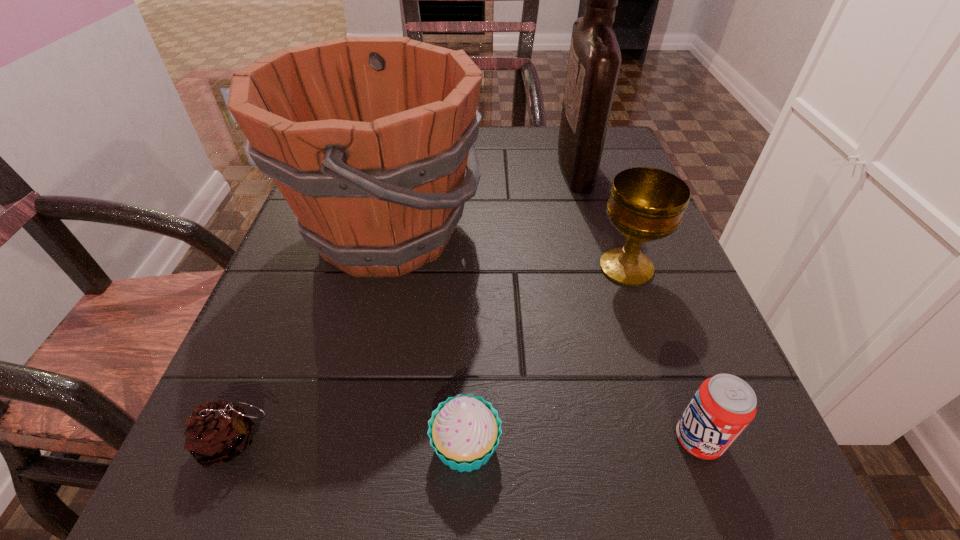
At what (x,y) coordinates should I click in order to perform the action: click on liquor. Please return your answer as a coordinate pair (x, y). The width and height of the screenshot is (960, 540). Looking at the image, I should click on (594, 62).

I want to click on bucket, so click(368, 138).

At what (x,y) coordinates should I click in order to perform the action: click on the fourth shortest object. Please return your answer as a coordinate pair (x, y). Image resolution: width=960 pixels, height=540 pixels. Looking at the image, I should click on (646, 204).

In order to click on soda can in this screenshot , I will do `click(723, 406)`.

You are a GUI agent. You are given a task and a screenshot of the screen. Output one action in this format:
    pyautogui.click(x=<x>, y=<y>)
    Task: Click on the cupcake
    This screenshot has height=540, width=960.
    Given the screenshot: What is the action you would take?
    pyautogui.click(x=464, y=431)

I want to click on the shortest object, so click(217, 432).

Where is `vacant space located on the label side of the tallest object`? The image size is (960, 540). vacant space located on the label side of the tallest object is located at coordinates (390, 166).

The image size is (960, 540). In order to click on vacant point located 0.250m on the label side of the tallest object in this screenshot , I will do `click(447, 166)`.

The height and width of the screenshot is (540, 960). What are the coordinates of `vacant area situated 0.240m on the label side of the tallest object` in the screenshot? It's located at (452, 166).

What are the coordinates of `vacant space located on the handle side of the bucket` in the screenshot? It's located at (519, 232).